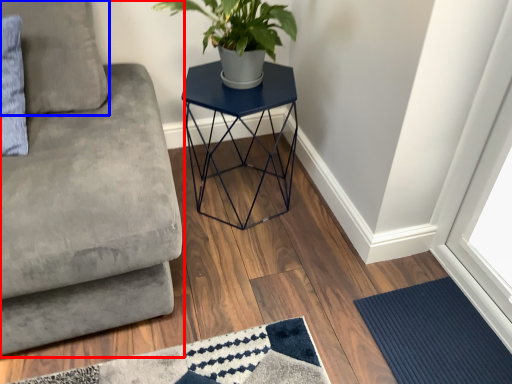
Question: Which of the following is the farthest to the observer, studio couch (highlighted by a red box) or pillow (highlighted by a blue box)?

Choices:
 (A) studio couch
 (B) pillow

Answer: (B)